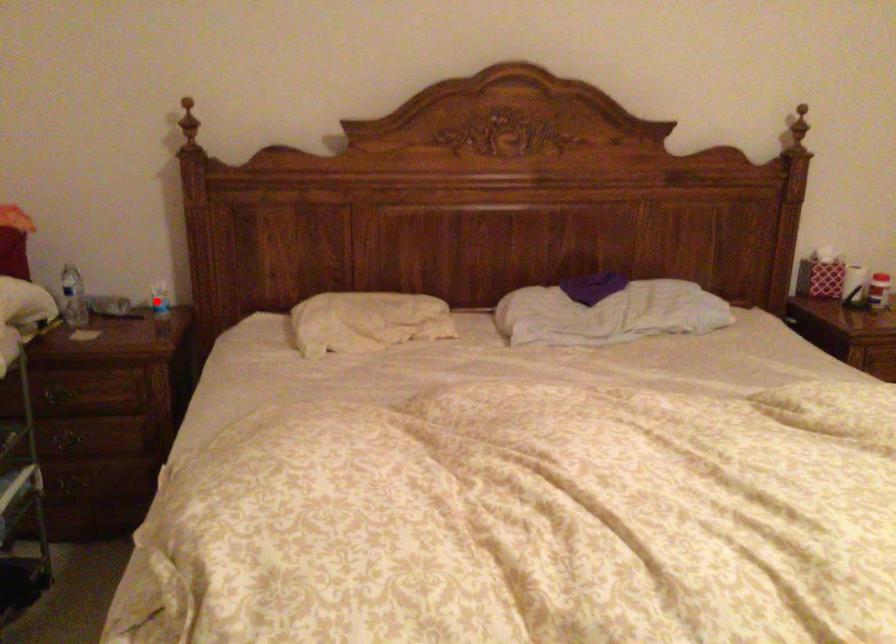
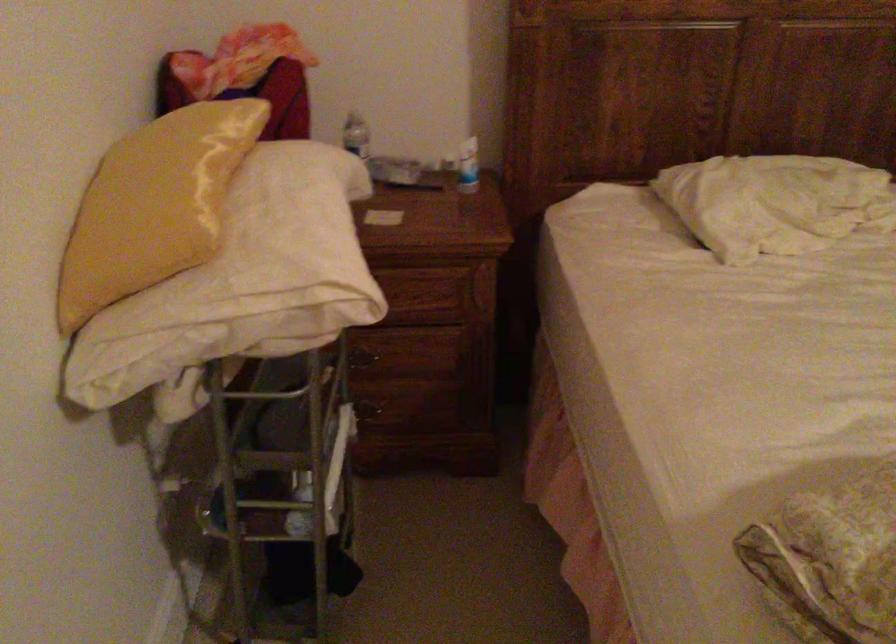
Where in the second image is the point corresponding to the highlighted location from the first image?

(468, 166)